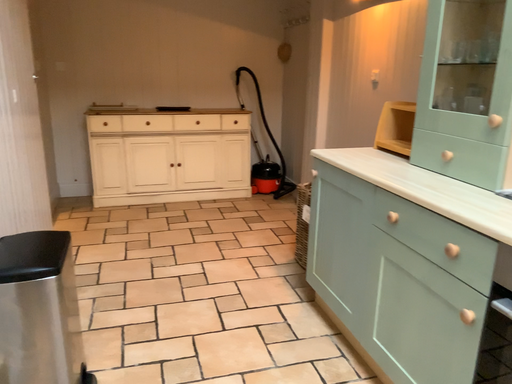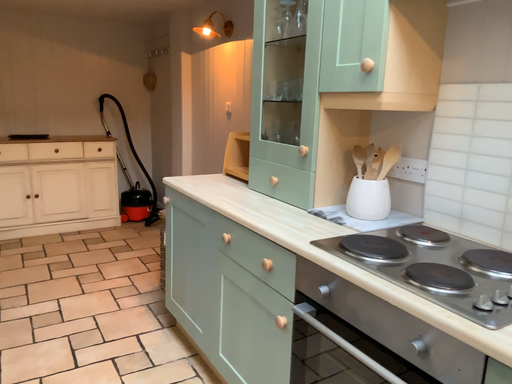
Question: How did the camera likely rotate when shooting the video?

Choices:
 (A) rotated right
 (B) rotated left

Answer: (A)